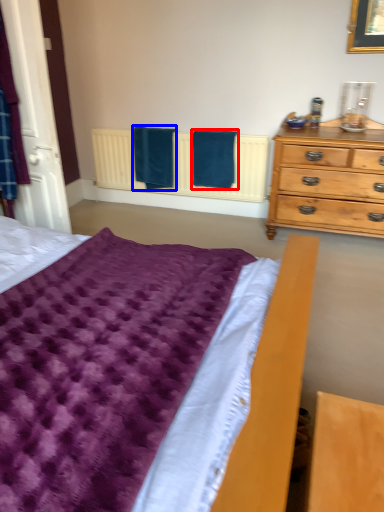
Question: Which of the following is the farthest to the observer, bath towel (highlighted by a red box) or bath towel (highlighted by a blue box)?

Choices:
 (A) bath towel
 (B) bath towel

Answer: (B)